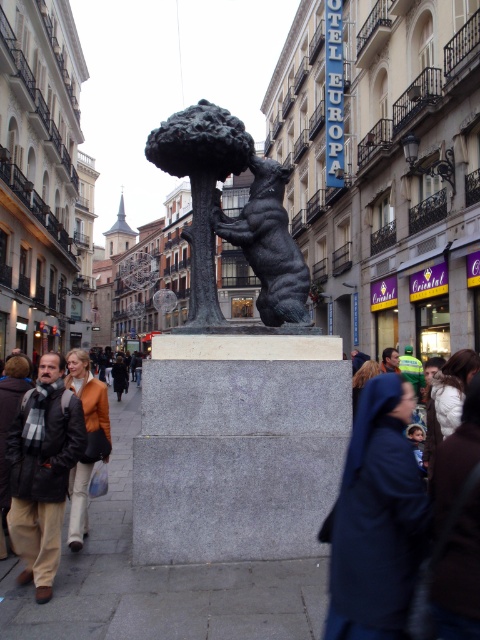
Which of these two, blue fabric headscarf at lower right or bronze bear at center, stands taller?

Standing taller between the two is bronze bear at center.

Does blue fabric headscarf at lower right have a larger size compared to bronze bear at center?

Actually, blue fabric headscarf at lower right might be smaller than bronze bear at center.

Which is in front, point (404, 593) or point (213, 320)?

Positioned in front is point (404, 593).

Locate an element on the screen. This screenshot has height=640, width=480. blue fabric headscarf at lower right is located at coordinates (376, 518).

Can you confirm if black wool coat at center is smaller than dark brown hair at center?

Incorrect, black wool coat at center is not smaller in size than dark brown hair at center.

Is point (127, 387) behind point (389, 362)?

Yes, it is.

The image size is (480, 640). I want to click on black wool coat at center, so click(120, 376).

Does bronze bear at center have a lesser width compared to dark brown hair at center?

Correct, bronze bear at center's width is less than dark brown hair at center's.

Is bronze bear at center to the left of dark brown hair at center from the viewer's perspective?

Indeed, bronze bear at center is positioned on the left side of dark brown hair at center.

Who is more forward, (x=177, y=140) or (x=382, y=368)?

Point (x=177, y=140)

I want to click on bronze bear at center, so click(232, 218).